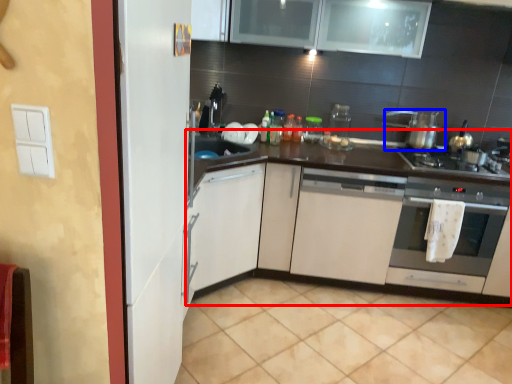
Question: Which point is further to the camera, countertop (highlighted by a red box) or kitchen appliance (highlighted by a blue box)?

Choices:
 (A) countertop
 (B) kitchen appliance

Answer: (B)